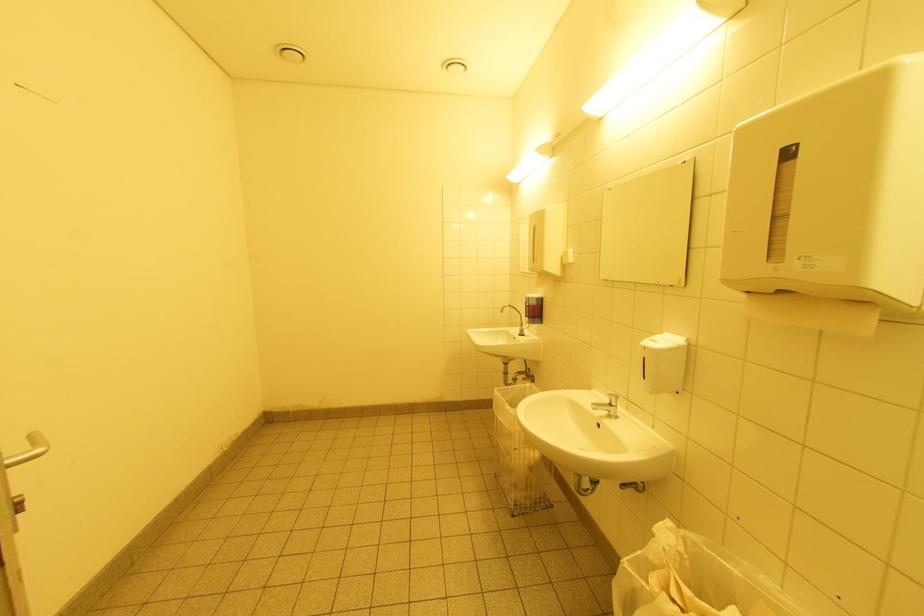
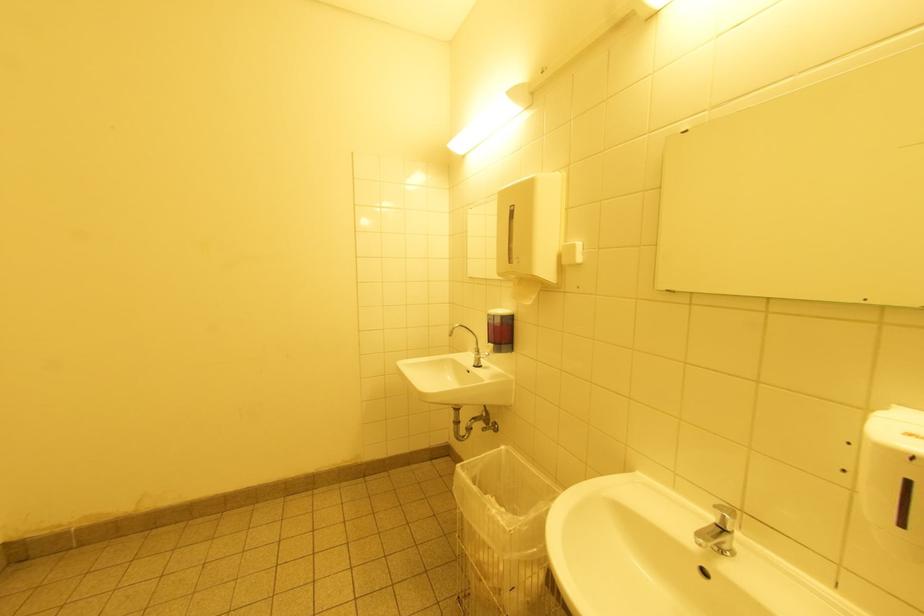
Question: In a continuous first-person perspective shot, in which direction is the camera moving?

Choices:
 (A) Left
 (B) Right
 (C) Forward
 (D) Backward

Answer: (C)